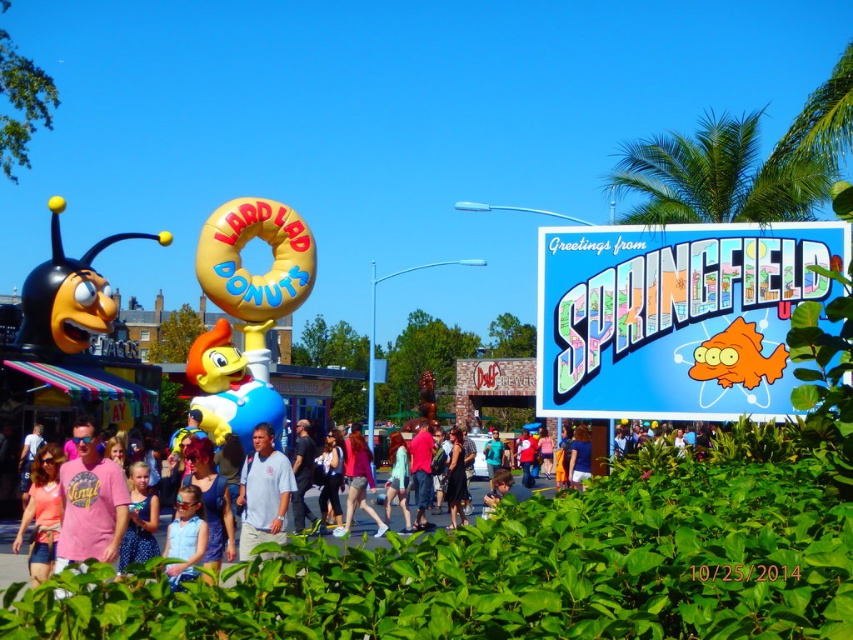
Question: Can you confirm if blue fabric shirt at center is bigger than matte pink shorts at center?

Choices:
 (A) yes
 (B) no

Answer: (B)

Question: Which of the following is the farthest from the observer?

Choices:
 (A) (195, 554)
 (B) (351, 518)
 (C) (252, 464)
 (D) (88, 492)

Answer: (B)

Question: Can you confirm if green leafy palm tree at upper right is positioned below blue fabric shirt at center?

Choices:
 (A) yes
 (B) no

Answer: (B)

Question: Which of the following is the farthest from the observer?

Choices:
 (A) (170, 563)
 (B) (352, 429)
 (C) (115, 500)
 (D) (831, 180)

Answer: (D)

Question: Which point appears farthest from the camera in this image?

Choices:
 (A) (119, 508)
 (B) (766, 195)

Answer: (B)

Question: Does green leafy palm tree at upper right appear on the left side of pink cotton shirt at lower left?

Choices:
 (A) yes
 (B) no

Answer: (B)